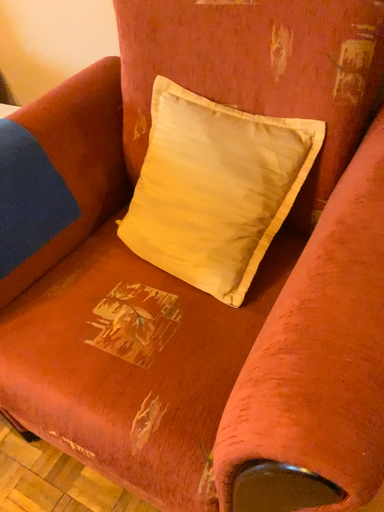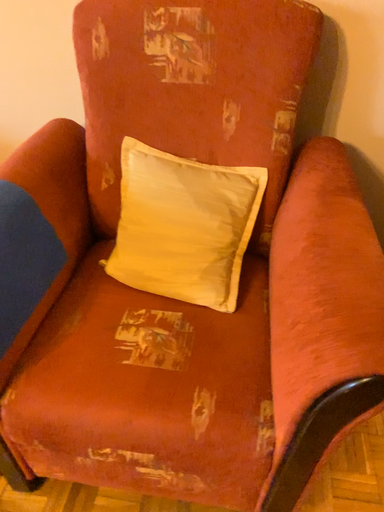
Question: How did the camera likely rotate when shooting the video?

Choices:
 (A) rotated right
 (B) rotated left

Answer: (A)